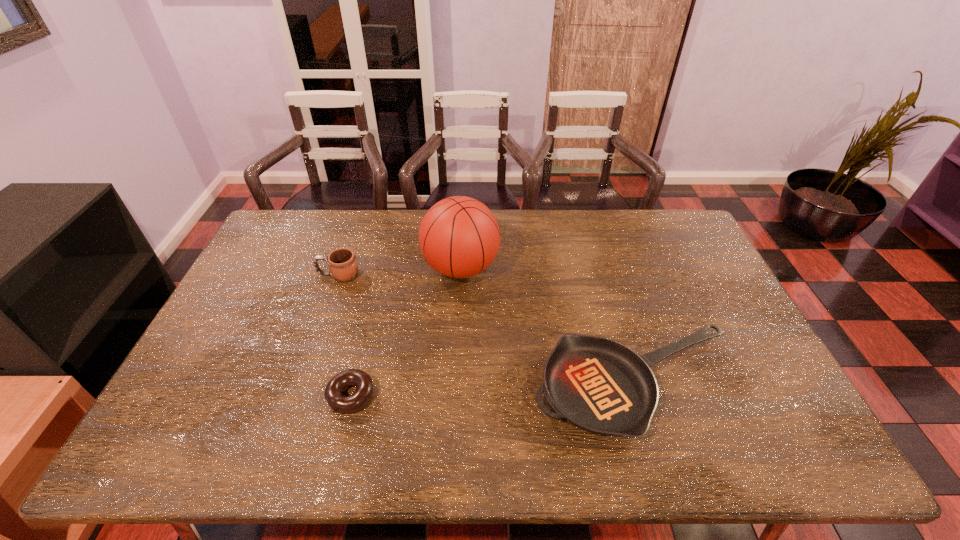
I want to click on empty location between the mug and the third object from right to left, so click(x=345, y=335).

The image size is (960, 540). I want to click on free spot between the second object from right to left and the doughnut, so click(406, 332).

Find the location of a particular element. Image resolution: width=960 pixels, height=540 pixels. object that stands as the closest to the third shortest object is located at coordinates (459, 237).

Identify the location of object that ranks as the third closest to the tallest object. This screenshot has width=960, height=540. (338, 402).

Where is `vacant space that satisfies the following two spatial constraints: 1. on the front side of the frying pan; 2. on the right side of the tallest object`? Image resolution: width=960 pixels, height=540 pixels. vacant space that satisfies the following two spatial constraints: 1. on the front side of the frying pan; 2. on the right side of the tallest object is located at coordinates (455, 384).

Identify the location of vacant space that satisfies the following two spatial constraints: 1. on the side of the third shortest object with the handle; 2. on the back side of the frying pan. The height and width of the screenshot is (540, 960). (300, 384).

The image size is (960, 540). I want to click on blank area in the image that satisfies the following two spatial constraints: 1. on the back side of the tallest object; 2. on the right side of the doughnut, so click(381, 268).

Where is `vacant position in the image that satisfies the following two spatial constraints: 1. on the back side of the rightmost object; 2. on the left side of the third object from right to left`? The image size is (960, 540). vacant position in the image that satisfies the following two spatial constraints: 1. on the back side of the rightmost object; 2. on the left side of the third object from right to left is located at coordinates (353, 384).

Locate an element on the screen. vacant space that satisfies the following two spatial constraints: 1. on the side of the leftmost object with the handle; 2. on the back side of the frying pan is located at coordinates (300, 384).